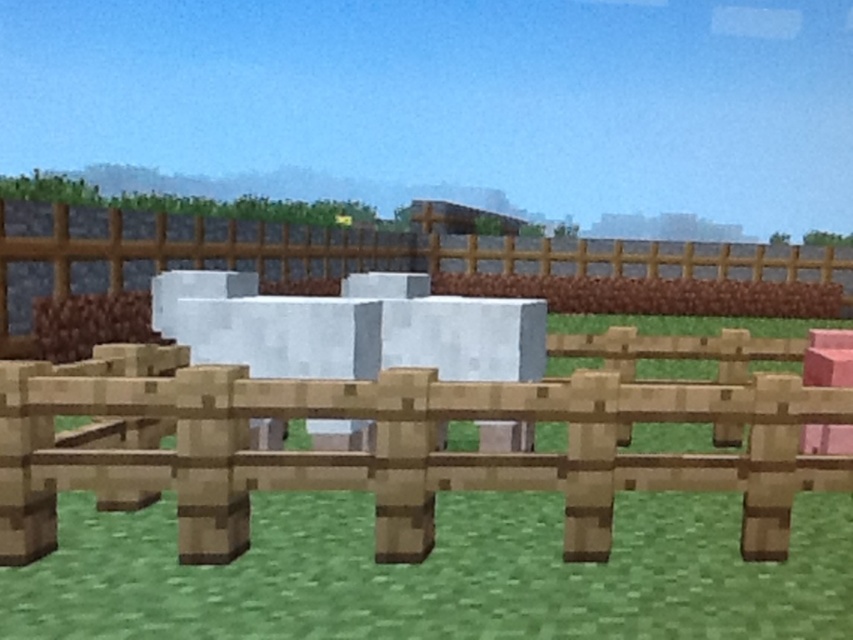
Question: Can you confirm if green grass at center is bigger than wooden fence at center?

Choices:
 (A) no
 (B) yes

Answer: (A)

Question: Is green grass at center in front of wooden fence at center?

Choices:
 (A) no
 (B) yes

Answer: (B)

Question: Which of the following is the closest to the observer?

Choices:
 (A) green grass at center
 (B) wooden fence at center

Answer: (A)

Question: Can you confirm if green grass at center is positioned to the left of wooden fence at center?

Choices:
 (A) no
 (B) yes

Answer: (B)

Question: Which of the following is the closest to the observer?

Choices:
 (A) (846, 497)
 (B) (119, 236)

Answer: (A)